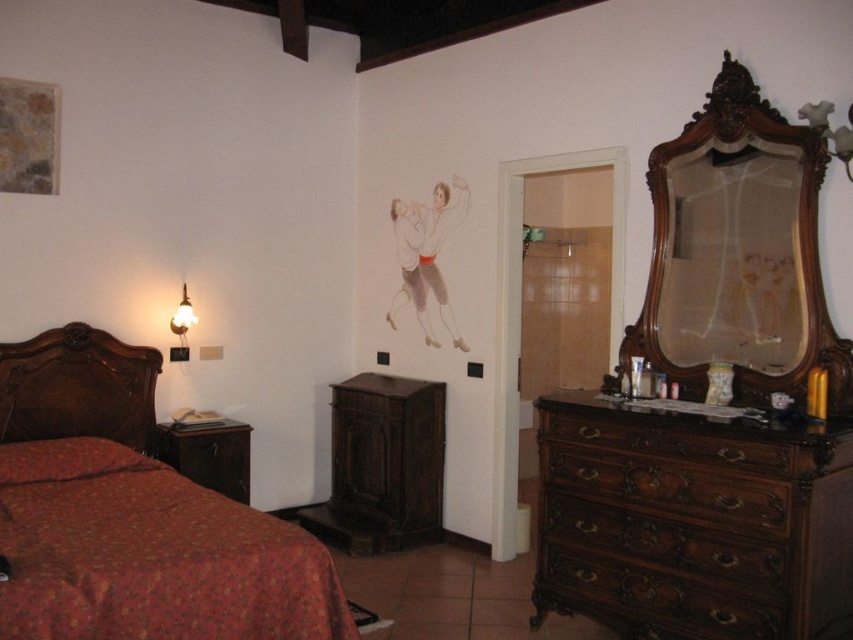
How far apart are matte wood headboard at left and matte gold lampshade at left?

matte wood headboard at left and matte gold lampshade at left are 47.23 centimeters apart.

Looking at this image, which of these two, matte wood headboard at left or matte gold lampshade at left, stands taller?

With more height is matte wood headboard at left.

Is point (61, 412) positioned behind point (178, 324)?

No.

Identify the location of matte wood headboard at left. (78, 387).

The image size is (853, 640). What do you see at coordinates (738, 252) in the screenshot?
I see `wooden mirror at right` at bounding box center [738, 252].

Can you confirm if wooden mirror at right is wider than brown wood nightstand at lower left?

Correct, the width of wooden mirror at right exceeds that of brown wood nightstand at lower left.

Between point (805, 136) and point (235, 477), which one is positioned in front?

Point (805, 136) is more forward.

The image size is (853, 640). I want to click on wooden mirror at right, so click(738, 252).

Can you confirm if dark brown wood dresser at right is taller than brown wood drawer at right?

Correct, dark brown wood dresser at right is much taller as brown wood drawer at right.

Is dark brown wood dresser at right to the right of brown wood drawer at right from the viewer's perspective?

Indeed, dark brown wood dresser at right is positioned on the right side of brown wood drawer at right.

Is point (770, 557) closer to camera compared to point (606, 497)?

Yes.

At what (x,y) coordinates should I click in order to perform the action: click on dark brown wood dresser at right. Please return your answer as a coordinate pair (x, y). The height and width of the screenshot is (640, 853). Looking at the image, I should click on (692, 522).